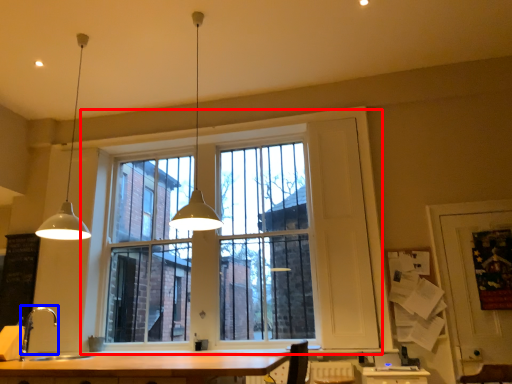
Question: Among these objects, which one is nearest to the camera, window (highlighted by a red box) or faucet (highlighted by a blue box)?

Choices:
 (A) window
 (B) faucet

Answer: (B)